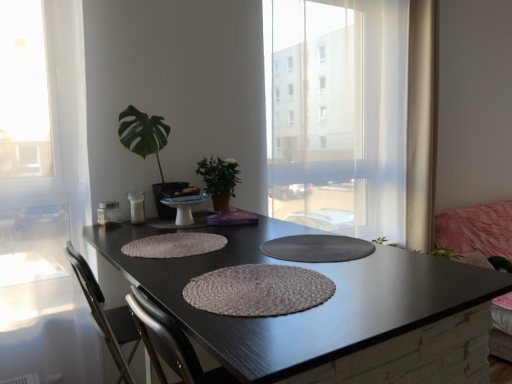
Where is `empty space that is in between rustic woven placemat at center, which is the second wide from back to front, and rustic woven placemat at center, placed as the first wide when sorted from back to front`? The width and height of the screenshot is (512, 384). empty space that is in between rustic woven placemat at center, which is the second wide from back to front, and rustic woven placemat at center, placed as the first wide when sorted from back to front is located at coordinates (201, 263).